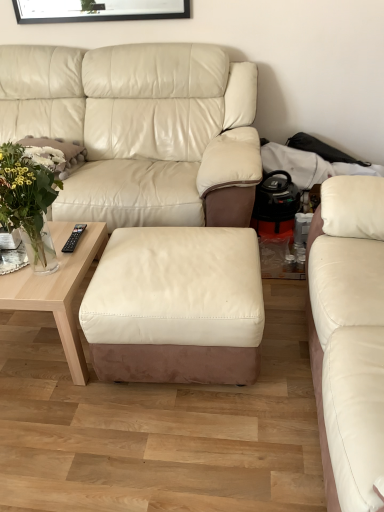
Find the location of a particular element. vacant space underneath translucent glass vase at upper left (from a real-world perspective) is located at coordinates (57, 271).